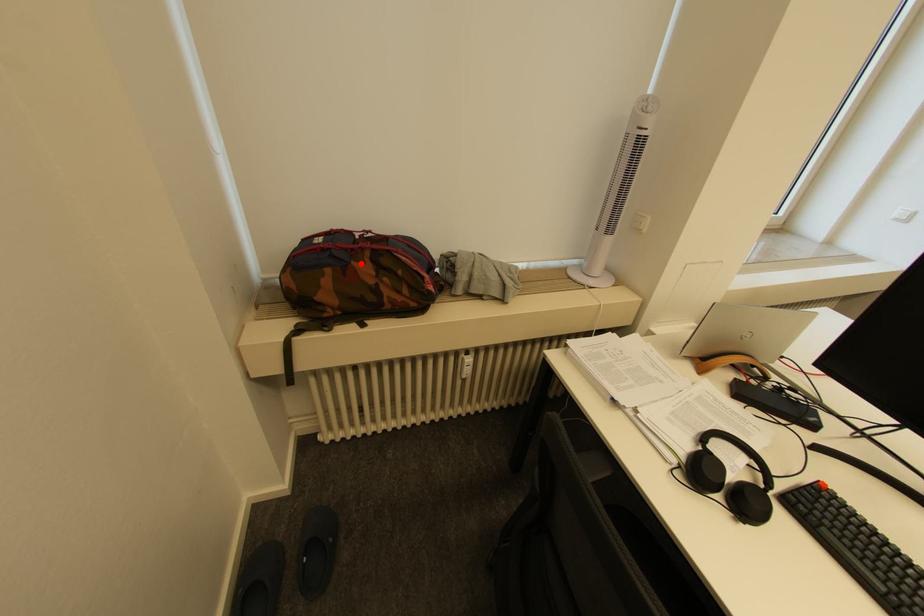
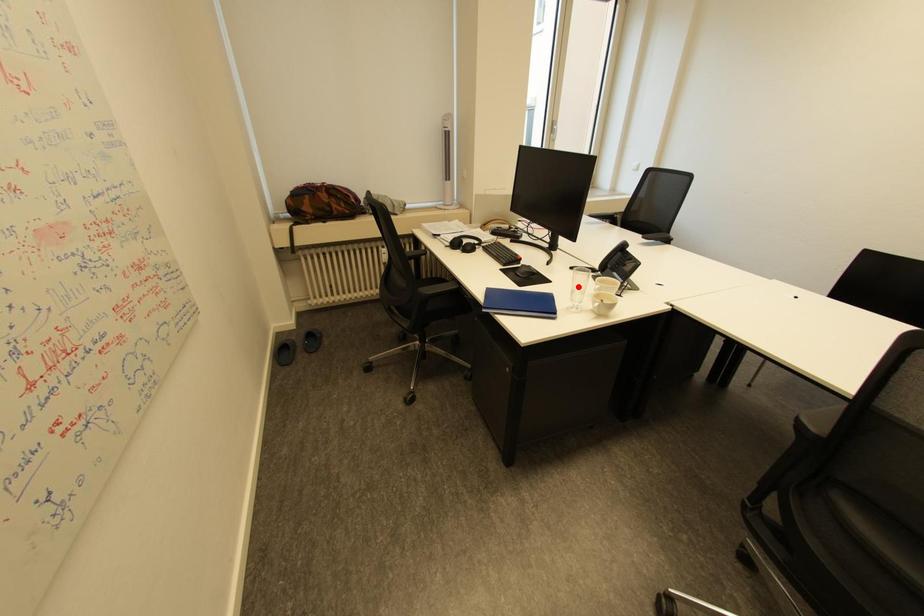
I am providing you with two images of the same scene from different viewpoints. A red point is marked on the first image and another point is marked on the second image. Do the highlighted points in image1 and image2 indicate the same real-world spot?

No